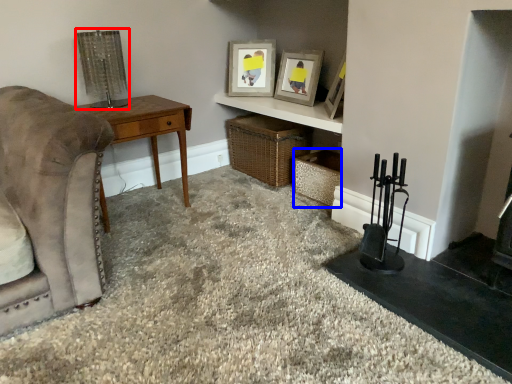
Question: Which object appears farthest to the camera in this image, lamp (highlighted by a red box) or crate (highlighted by a blue box)?

Choices:
 (A) lamp
 (B) crate

Answer: (B)